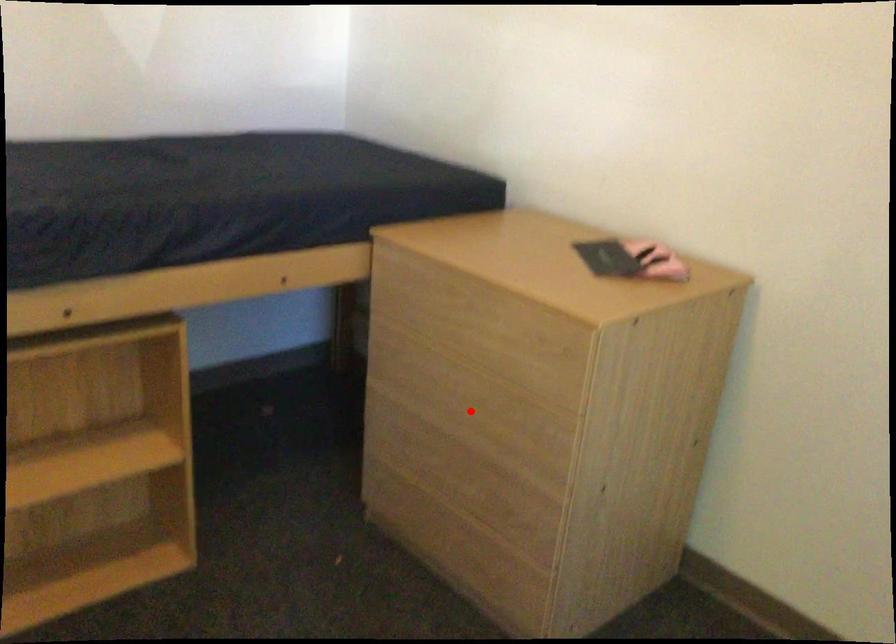
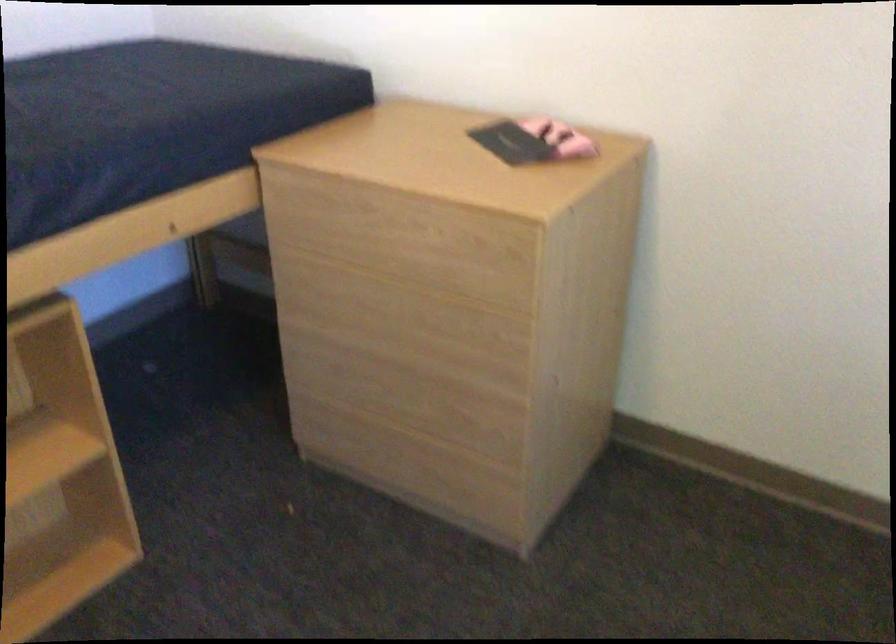
The point at the highlighted location is marked in the first image. Where is the corresponding point in the second image?

(410, 327)